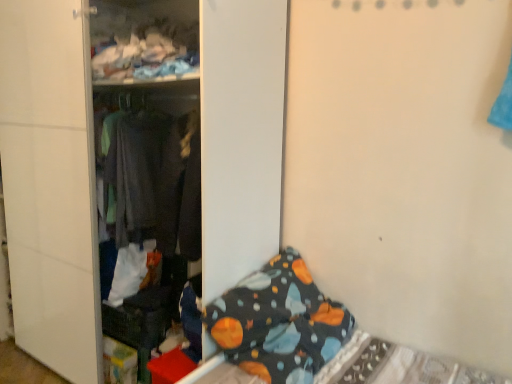
You are a GUI agent. You are given a task and a screenshot of the screen. Output one action in this format:
    pyautogui.click(x=<x>, y=<y>)
    Task: Click on the dark gray fabric at center
    Image resolution: width=512 pixels, height=384 pixels.
    Given the screenshot: What is the action you would take?
    pyautogui.click(x=141, y=173)

Measure the distance between point (296, 375) and camera.

They are 5.49 feet apart.

You are a GUI agent. You are given a task and a screenshot of the screen. Output one action in this format:
    pyautogui.click(x=<x>, y=<y>)
    Task: Click on the dark blue fabric pillow at lower right
    This screenshot has width=512, height=384.
    Given the screenshot: What is the action you would take?
    pyautogui.click(x=279, y=322)

Locate an element on the screen. Image resolution: width=512 pixels, height=384 pixels. dark gray fabric at center is located at coordinates (141, 173).

Is dark gray fabric at center outside of dark blue fabric blanket at lower right?

No, dark gray fabric at center is inside or overlapping with dark blue fabric blanket at lower right.

Locate an element on the screen. clothing behind the dark blue fabric blanket at lower right is located at coordinates (141, 173).

Which of these two, dark gray fabric at center or dark blue fabric blanket at lower right, stands taller?

Standing taller between the two is dark blue fabric blanket at lower right.

Is dark blue fabric blanket at lower right at the back of dark gray fabric at center?

Yes, dark blue fabric blanket at lower right is at the back of dark gray fabric at center.

How many degrees apart are the facing directions of dark blue fabric blanket at lower right and dark blue fabric bed at lower right?

There is a 89.2-degree angle between the facing directions of dark blue fabric blanket at lower right and dark blue fabric bed at lower right.

Where is `bed in front of the dark blue fabric blanket at lower right`? Image resolution: width=512 pixels, height=384 pixels. bed in front of the dark blue fabric blanket at lower right is located at coordinates (310, 338).

Is dark blue fabric bed at lower right completely or partially inside dark blue fabric blanket at lower right?

No.

Considering the positions of objects dark blue fabric blanket at lower right and dark blue fabric bed at lower right in the image provided, who is more to the left, dark blue fabric blanket at lower right or dark blue fabric bed at lower right?

Positioned to the left is dark blue fabric blanket at lower right.

Can you see dark gray fabric at center touching dark blue fabric pillow at lower right?

No, dark gray fabric at center is not in contact with dark blue fabric pillow at lower right.

Which is more to the right, dark gray fabric at center or dark blue fabric pillow at lower right?

From the viewer's perspective, dark blue fabric pillow at lower right appears more on the right side.

Is dark gray fabric at center not within dark blue fabric pillow at lower right?

Yes, dark gray fabric at center is located beyond the bounds of dark blue fabric pillow at lower right.

Considering the positions of objects dark gray fabric at center and dark blue fabric pillow at lower right in the image provided, who is in front, dark gray fabric at center or dark blue fabric pillow at lower right?

dark blue fabric pillow at lower right is more forward.

Is dark gray fabric at center oriented towards dark blue fabric bed at lower right?

No, dark gray fabric at center is not oriented towards dark blue fabric bed at lower right.

From a real-world perspective, who is located lower, dark gray fabric at center or dark blue fabric bed at lower right?

From a 3D spatial view, dark blue fabric bed at lower right is below.

Considering the relative sizes of dark gray fabric at center and dark blue fabric bed at lower right in the image provided, is dark gray fabric at center wider than dark blue fabric bed at lower right?

No, dark gray fabric at center is not wider than dark blue fabric bed at lower right.

Looking at the image, does dark blue fabric pillow at lower right seem bigger or smaller compared to dark blue fabric bed at lower right?

dark blue fabric pillow at lower right is smaller than dark blue fabric bed at lower right.

Is point (233, 345) positioned before point (298, 272)?

Yes, point (233, 345) is in front of point (298, 272).

Considering the relative sizes of dark blue fabric pillow at lower right and dark blue fabric bed at lower right in the image provided, is dark blue fabric pillow at lower right thinner than dark blue fabric bed at lower right?

Yes, dark blue fabric pillow at lower right is thinner than dark blue fabric bed at lower right.

Looking at this image, how different are the orientations of dark blue fabric pillow at lower right and dark blue fabric bed at lower right in degrees?

dark blue fabric pillow at lower right and dark blue fabric bed at lower right are facing 169 degrees away from each other.

Considering the positions of point (421, 361) and point (121, 185), is point (421, 361) closer or farther from the camera than point (121, 185)?

Point (421, 361) appears to be closer to the viewer than point (121, 185).

Which is more to the right, dark blue fabric bed at lower right or dark gray fabric at center?

From the viewer's perspective, dark blue fabric bed at lower right appears more on the right side.

From the image's perspective, which is above, dark blue fabric bed at lower right or dark gray fabric at center?

dark gray fabric at center is shown above in the image.

Are dark blue fabric bed at lower right and dark blue fabric pillow at lower right far apart?

No, dark blue fabric bed at lower right is not far from dark blue fabric pillow at lower right.

Looking at the image, does dark blue fabric bed at lower right seem bigger or smaller compared to dark blue fabric pillow at lower right?

dark blue fabric bed at lower right is bigger than dark blue fabric pillow at lower right.

From a real-world perspective, is dark blue fabric bed at lower right physically below dark blue fabric pillow at lower right?

Yes.

The width and height of the screenshot is (512, 384). I want to click on furniture directly beneath the dark gray fabric at center (from a real-world perspective), so click(x=134, y=156).

The height and width of the screenshot is (384, 512). I want to click on furniture above the dark blue fabric bed at lower right (from a real-world perspective), so click(134, 156).

Looking at the image, which one is located closer to dark blue fabric pillow at lower right, dark blue fabric blanket at lower right or dark gray fabric at center?

The object closer to dark blue fabric pillow at lower right is dark blue fabric blanket at lower right.

Which object lies further to the anchor point dark blue fabric pillow at lower right, dark gray fabric at center or dark blue fabric blanket at lower right?

dark gray fabric at center.

Considering their positions, is dark blue fabric blanket at lower right positioned closer to dark gray fabric at center than dark blue fabric pillow at lower right?

Among the two, dark blue fabric blanket at lower right is located nearer to dark gray fabric at center.

Based on their spatial positions, is dark blue fabric bed at lower right or dark gray fabric at center further from dark blue fabric blanket at lower right?

dark blue fabric bed at lower right is further to dark blue fabric blanket at lower right.

When comparing their distances from dark gray fabric at center, does dark blue fabric bed at lower right or dark blue fabric blanket at lower right seem further?

dark blue fabric bed at lower right is positioned further to the anchor dark gray fabric at center.

Considering their positions, is dark blue fabric pillow at lower right positioned further to dark gray fabric at center than dark blue fabric blanket at lower right?

The object further to dark gray fabric at center is dark blue fabric pillow at lower right.

When comparing their distances from dark blue fabric bed at lower right, does dark gray fabric at center or dark blue fabric pillow at lower right seem further?

dark gray fabric at center.

Estimate the real-world distances between objects in this image. Which object is closer to dark blue fabric blanket at lower right, dark blue fabric pillow at lower right or dark blue fabric bed at lower right?

dark blue fabric pillow at lower right is positioned closer to the anchor dark blue fabric blanket at lower right.

Find the location of a particular element. clothing between dark blue fabric blanket at lower right and dark blue fabric pillow at lower right from left to right is located at coordinates (141, 173).

You are a GUI agent. You are given a task and a screenshot of the screen. Output one action in this format:
    pyautogui.click(x=<x>, y=<y>)
    Task: Click on the pillow between dark blue fabric blanket at lower right and dark blue fabric bed at lower right in the horizontal direction
    The width and height of the screenshot is (512, 384).
    Given the screenshot: What is the action you would take?
    pyautogui.click(x=279, y=322)

Where is `clothing between dark blue fabric blanket at lower right and dark blue fabric bed at lower right`? clothing between dark blue fabric blanket at lower right and dark blue fabric bed at lower right is located at coordinates (141, 173).

Identify the location of pillow located between dark blue fabric bed at lower right and dark gray fabric at center in the depth direction. (279, 322).